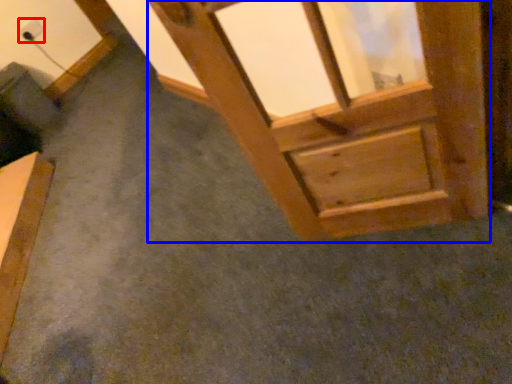
Question: Which of the following is the closest to the observer, electric outlet (highlighted by a red box) or window frame (highlighted by a blue box)?

Choices:
 (A) electric outlet
 (B) window frame

Answer: (B)